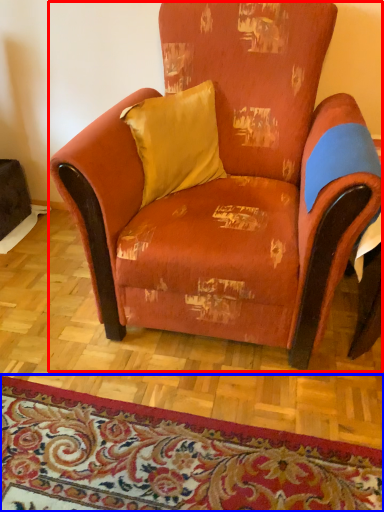
Question: Which object appears closest to the camera in this image, chair (highlighted by a red box) or mat (highlighted by a blue box)?

Choices:
 (A) chair
 (B) mat

Answer: (A)